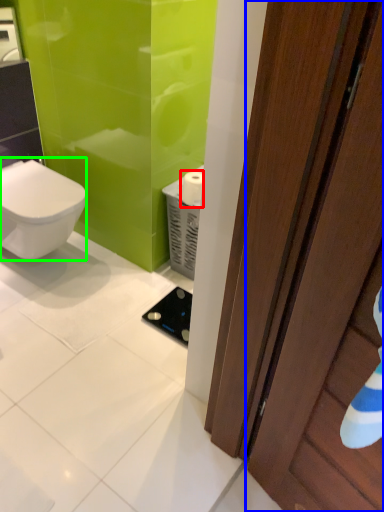
Question: Which is nearer to the toilet paper (highlighted by a red box)? door (highlighted by a blue box) or bidet (highlighted by a green box).

Choices:
 (A) door
 (B) bidet

Answer: (B)